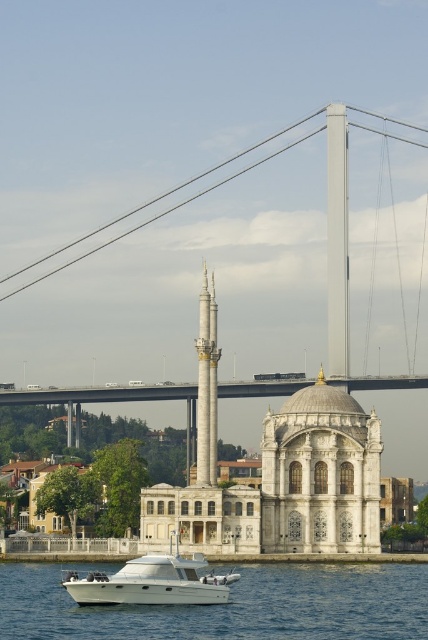
Which is in front, point (23, 632) or point (333, 541)?

Positioned in front is point (23, 632).

Can you confirm if white glossy water at lower center is positioned below metallic gray suspension bridge at upper center?

Yes.

Where is `white glossy water at lower center`? The image size is (428, 640). white glossy water at lower center is located at coordinates (231, 605).

Find the location of `metallic gray suspension bridge at upper center`. metallic gray suspension bridge at upper center is located at coordinates pos(326,241).

Which is below, metallic gray suspension bridge at upper center or white glossy boat at lower center?

white glossy boat at lower center

What are the coordinates of `metallic gray suspension bridge at upper center` in the screenshot? It's located at (326, 241).

Which is more to the left, white glossy water at lower center or white glossy boat at lower center?

Positioned to the left is white glossy boat at lower center.

You are a GUI agent. You are given a task and a screenshot of the screen. Output one action in this format:
    pyautogui.click(x=<x>, y=<y>)
    Task: Click on the white glossy water at lower center
    
    Given the screenshot: What is the action you would take?
    click(231, 605)

Locate an element on the screen. The image size is (428, 640). white glossy water at lower center is located at coordinates (231, 605).